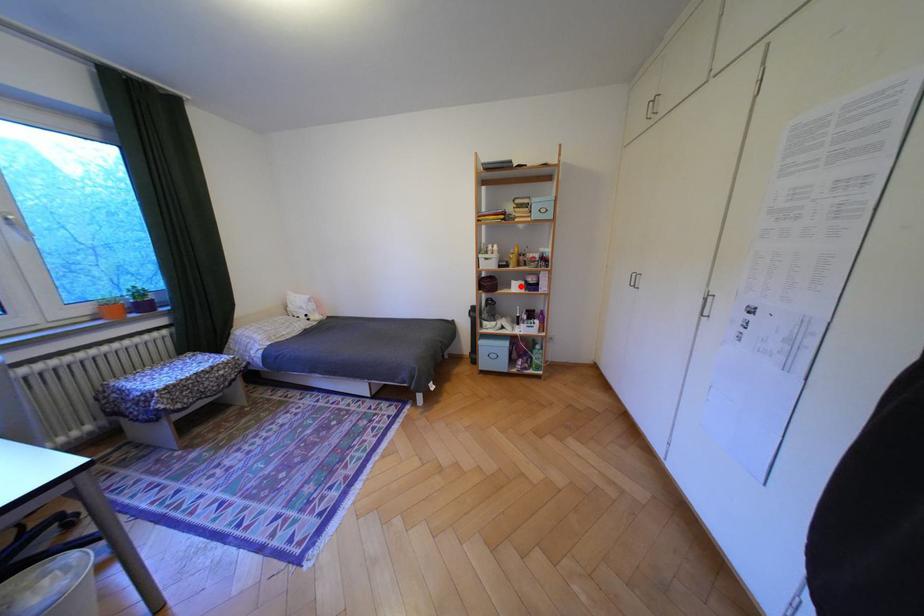
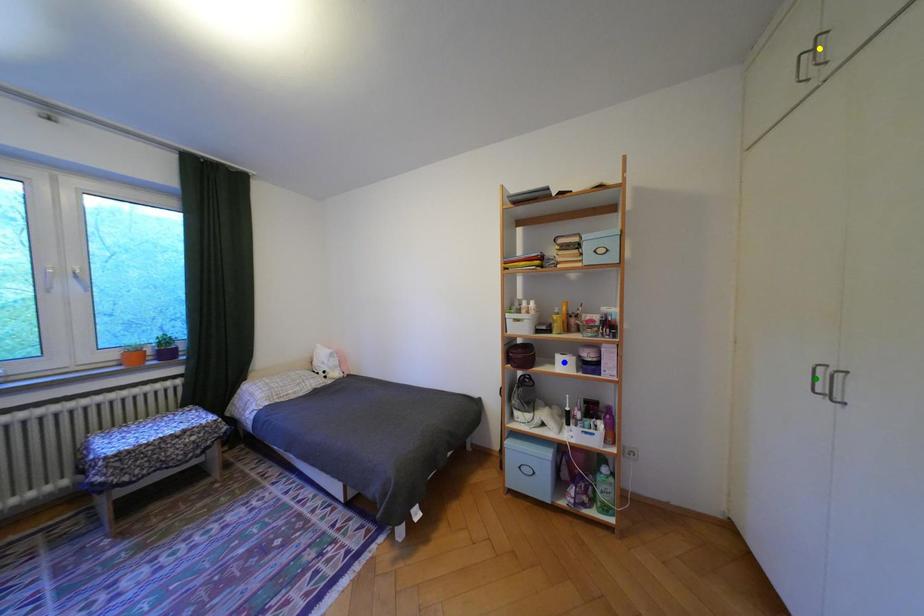
Question: I am providing you with two images of the same scene from different viewpoints. A red point is marked on the first image. You are given multiple points on the second image. Which mark in image 2 goes with the point in image 1?

Choices:
 (A) yellow point
 (B) blue point
 (C) green point

Answer: (B)